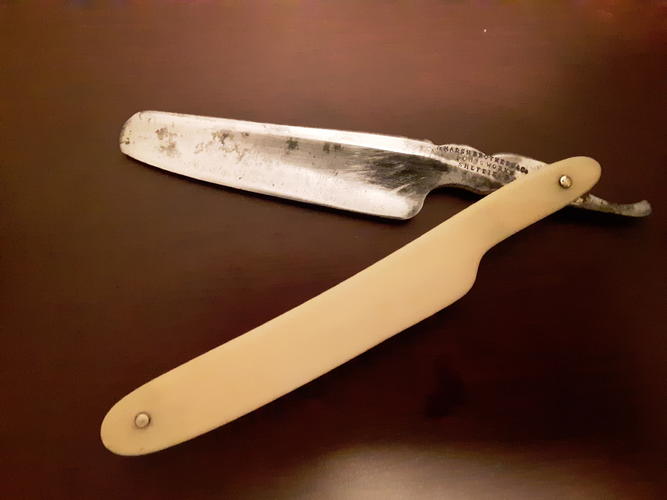
The height and width of the screenshot is (500, 667). Find the location of `brown handle`. brown handle is located at coordinates (340, 318).